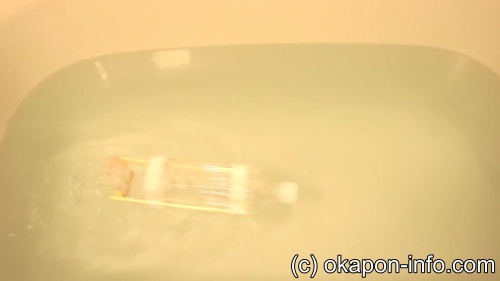
Find the location of a particular element. Image resolution: width=500 pixels, height=281 pixels. yellow tub is located at coordinates (200, 38).